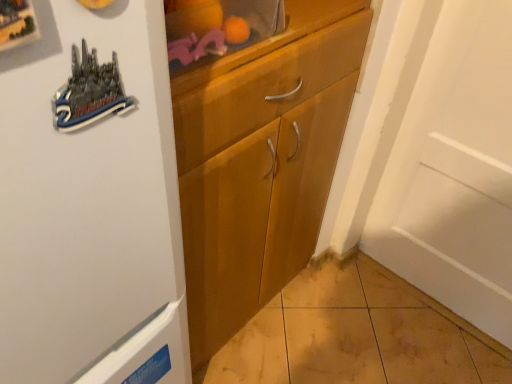
Question: Would you consider wooden cabinet at upper center to be distant from wooden cabinet at center?

Choices:
 (A) no
 (B) yes

Answer: (A)

Question: Are wooden cabinet at upper center and wooden cabinet at center making contact?

Choices:
 (A) no
 (B) yes

Answer: (A)

Question: Is wooden cabinet at upper center outside wooden cabinet at center?

Choices:
 (A) yes
 (B) no

Answer: (A)

Question: Considering the relative sizes of wooden cabinet at upper center and wooden cabinet at center in the image provided, is wooden cabinet at upper center taller than wooden cabinet at center?

Choices:
 (A) yes
 (B) no

Answer: (B)

Question: Is wooden cabinet at upper center positioned in front of wooden cabinet at center?

Choices:
 (A) yes
 (B) no

Answer: (A)

Question: From a real-world perspective, is wooden cabinet at upper center over wooden cabinet at center?

Choices:
 (A) no
 (B) yes

Answer: (B)

Question: Is wooden cabinet at center aimed at wooden cabinet at upper center?

Choices:
 (A) no
 (B) yes

Answer: (A)

Question: Is wooden cabinet at upper center at the back of wooden cabinet at center?

Choices:
 (A) yes
 (B) no

Answer: (B)

Question: Is wooden cabinet at center bigger than wooden cabinet at upper center?

Choices:
 (A) no
 (B) yes

Answer: (B)

Question: Does wooden cabinet at center have a lesser height compared to wooden cabinet at upper center?

Choices:
 (A) no
 (B) yes

Answer: (A)

Question: Can you see wooden cabinet at center touching wooden cabinet at upper center?

Choices:
 (A) no
 (B) yes

Answer: (A)

Question: Would you say wooden cabinet at center is outside wooden cabinet at upper center?

Choices:
 (A) no
 (B) yes

Answer: (B)

Question: Based on their sizes in the image, would you say wooden cabinet at center is bigger or smaller than wooden cabinet at upper center?

Choices:
 (A) big
 (B) small

Answer: (A)